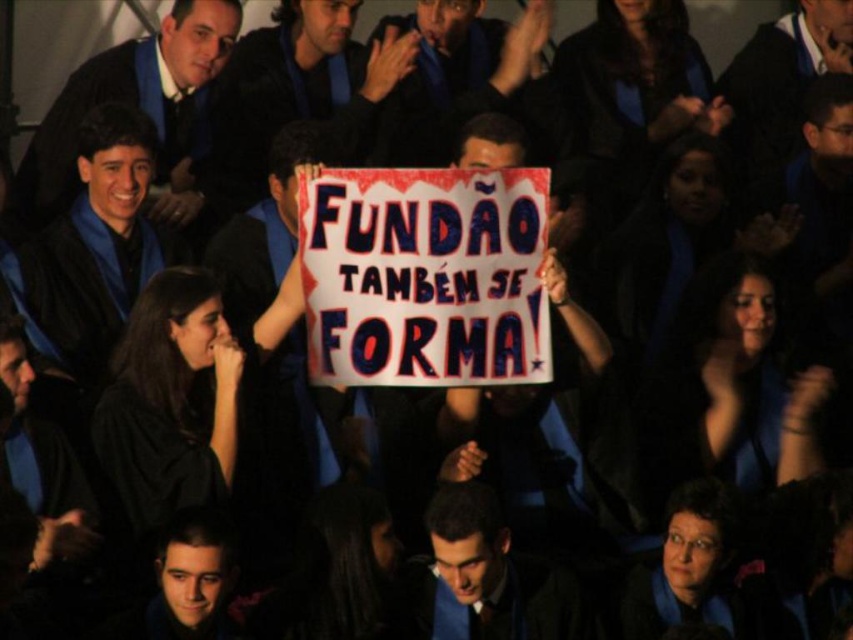
You are a photographer at the graduation ceremony. You need to capture a photo where both the matte black graduation gown at left and the matte black graduation gown at upper center are visible. Which gown should you focus on to ensure both are in frame without moving the camera?

The matte black graduation gown at upper center is shorter in height than the matte black graduation gown at left, so focusing on the taller gown at left will ensure both are in frame without needing to adjust the camera position.

You are standing at the origin of a coordinate system placed at the bottom left corner of the image. You see two points labeled point (463, 621) and point (210, 595). Which point is closer to you?

Point (210, 595) is closer to you because it has a lower y coordinate than point (463, 621), and since the origin is at the bottom left, lower y coordinates are closer to the viewer.